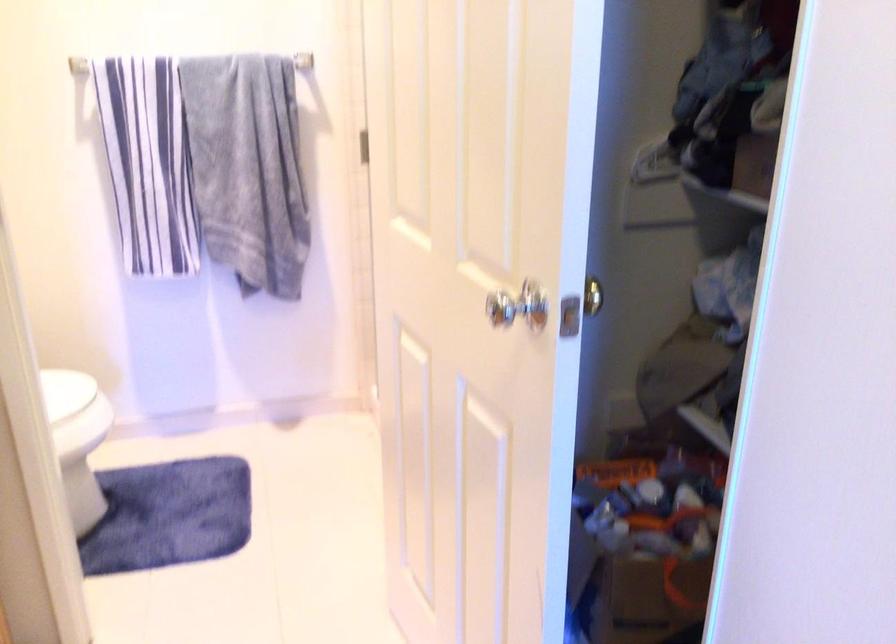
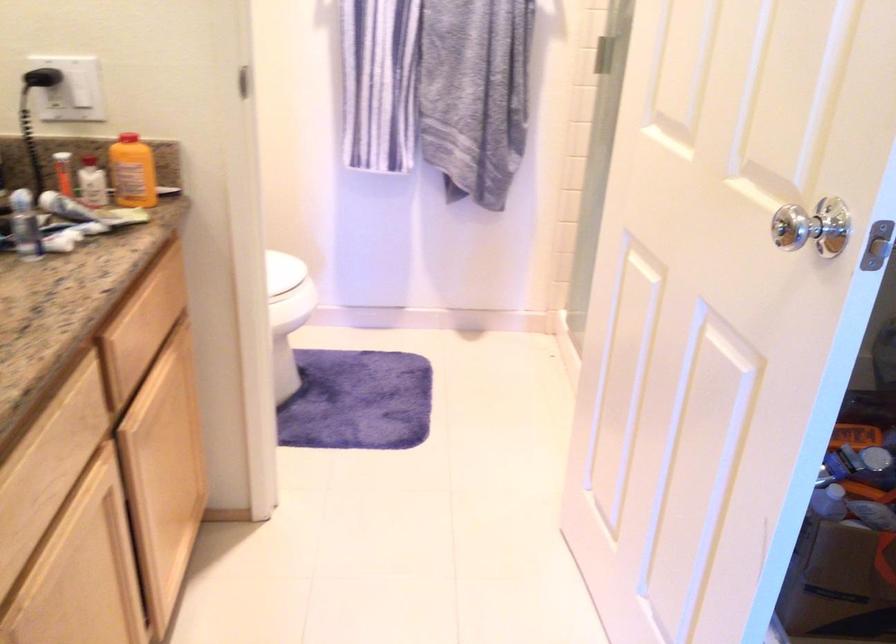
What movement of the cameraman would produce the second image?

The movement direction of the cameraman is left, forward.